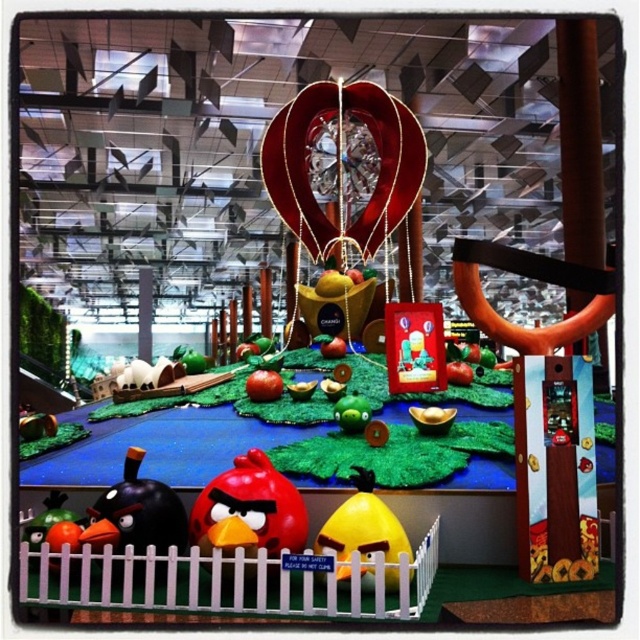
Is shiny red phone at center thinner than green matte apple at center?

No, shiny red phone at center is not thinner than green matte apple at center.

Is point (392, 356) behind point (349, 420)?

Yes, it is behind point (349, 420).

Find the location of `shiny red phone at center`. shiny red phone at center is located at coordinates (413, 348).

Does green matte apple at center have a lesser height compared to red matte apple at center?

Yes, green matte apple at center is shorter than red matte apple at center.

Who is taller, green matte apple at center or red matte apple at center?

Standing taller between the two is red matte apple at center.

Find the location of `green matte apple at center`. green matte apple at center is located at coordinates (352, 412).

Who is more forward, (131, 536) or (353, 500)?

Point (131, 536)

Can you confirm if matte black bird at lower left is bigger than yellow matte/yellowish plastic bird at center?

Incorrect, matte black bird at lower left is not larger than yellow matte/yellowish plastic bird at center.

I want to click on matte black bird at lower left, so click(136, 513).